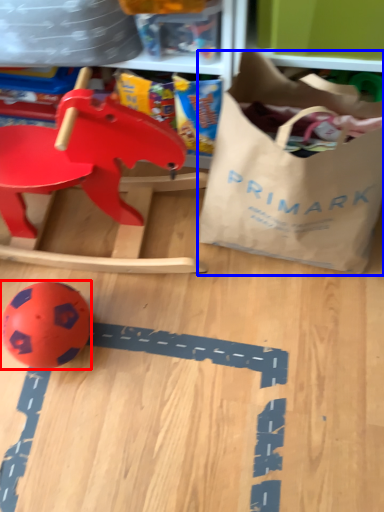
Question: Among these objects, which one is farthest to the camera, toy (highlighted by a red box) or grocery bag (highlighted by a blue box)?

Choices:
 (A) toy
 (B) grocery bag

Answer: (A)